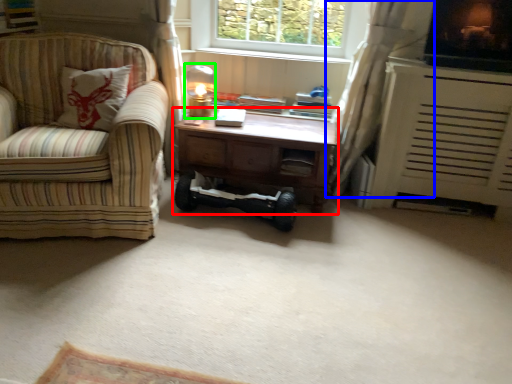
Question: Which object is positioned closest to desk (highlighted by a red box)? Select from curtain (highlighted by a blue box) and table lamp (highlighted by a green box).

Choices:
 (A) curtain
 (B) table lamp

Answer: (A)